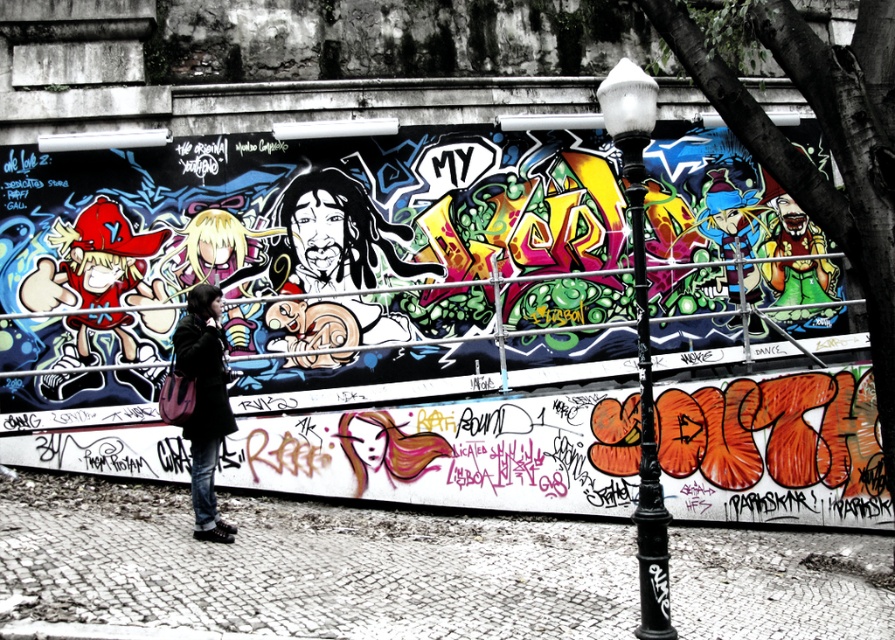
Question: Among these objects, which one is farthest from the camera?

Choices:
 (A) black metal lamp post at center
 (B) dark blue denim jacket at lower left

Answer: (B)

Question: Which object is closer to the camera taking this photo?

Choices:
 (A) black metal lamp post at center
 (B) dark blue denim jacket at lower left

Answer: (A)

Question: Can you confirm if metal scaffolding at center is positioned to the right of black metal lamp post at center?

Choices:
 (A) no
 (B) yes

Answer: (A)

Question: Which point is closer to the camera?

Choices:
 (A) 646,113
 (B) 552,330
 (C) 212,412

Answer: (A)

Question: Is metal scaffolding at center above dark blue denim jacket at lower left?

Choices:
 (A) no
 (B) yes

Answer: (B)

Question: Does black metal lamp post at center appear on the right side of dark blue denim jacket at lower left?

Choices:
 (A) no
 (B) yes

Answer: (B)